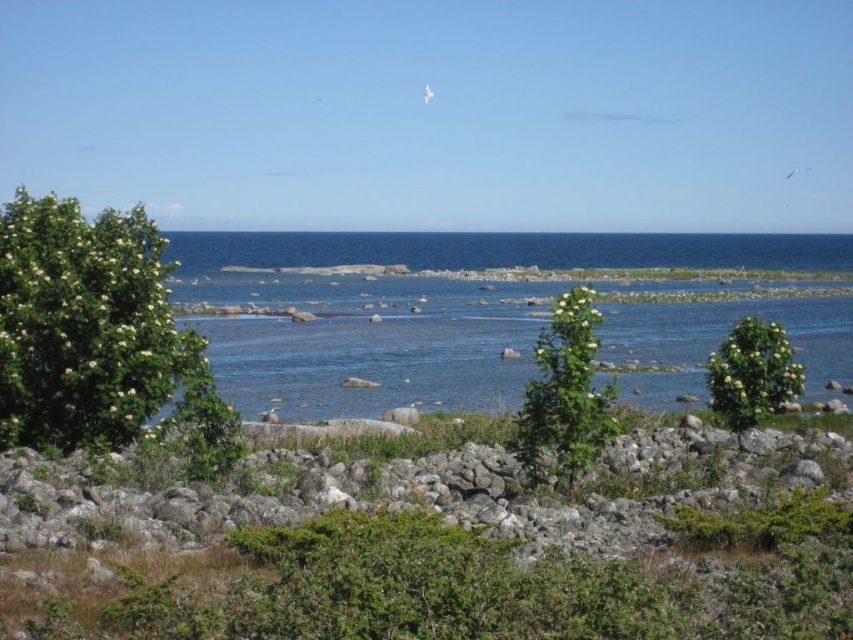
Can you confirm if gray rock at center is positioned below green leafy bush at left?

Indeed, gray rock at center is positioned under green leafy bush at left.

Can you confirm if gray rock at center is positioned above green leafy bush at left?

No.

Between point (167, 472) and point (71, 355), which one is positioned in front?

Point (167, 472) is in front.

Image resolution: width=853 pixels, height=640 pixels. I want to click on gray rock at center, so click(x=416, y=490).

How far apart are clear blue water at center and gray rock at center?

clear blue water at center and gray rock at center are 64.59 meters apart from each other.

Does point (440, 291) come farther from viewer compared to point (415, 468)?

That is True.

Where is `clear blue water at center`? This screenshot has height=640, width=853. clear blue water at center is located at coordinates (483, 314).

Does gray rock at center appear under green leafy shrub at center?

Yes.

Does gray rock at center have a greater width compared to green leafy shrub at center?

Correct, the width of gray rock at center exceeds that of green leafy shrub at center.

You are a GUI agent. You are given a task and a screenshot of the screen. Output one action in this format:
    pyautogui.click(x=<x>, y=<y>)
    Task: Click on the gray rock at center
    The width and height of the screenshot is (853, 640).
    Given the screenshot: What is the action you would take?
    pyautogui.click(x=416, y=490)

This screenshot has height=640, width=853. I want to click on gray rock at center, so click(x=416, y=490).